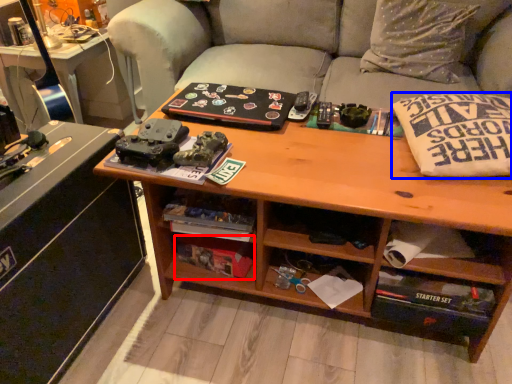
Question: Which object appears farthest to the camera in this image, book (highlighted by a red box) or pillow (highlighted by a blue box)?

Choices:
 (A) book
 (B) pillow

Answer: (A)